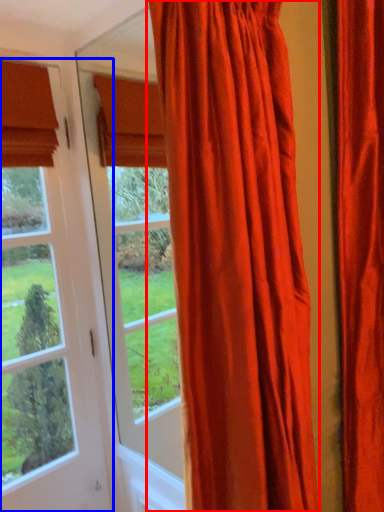
Question: Which point is further to the camera, curtain (highlighted by a red box) or window (highlighted by a blue box)?

Choices:
 (A) curtain
 (B) window

Answer: (B)